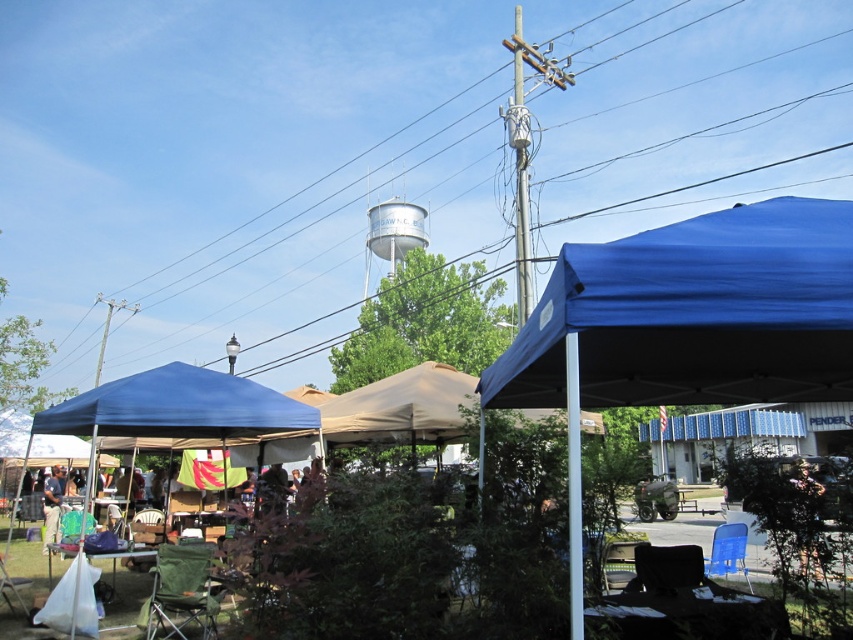
Question: Among these points, which one is nearest to the camera?

Choices:
 (A) (688, 548)
 (B) (521, 269)
 (C) (642, 538)

Answer: (A)

Question: Is blue fabric tent at upper center to the right of blue fabric canopy at upper right from the viewer's perspective?

Choices:
 (A) no
 (B) yes

Answer: (A)

Question: Is metallic gray pole at center wider than black fabric chair at lower right?

Choices:
 (A) no
 (B) yes

Answer: (B)

Question: Considering the relative positions of green canvas chair at lower left and metallic gray pole at center in the image provided, where is green canvas chair at lower left located with respect to metallic gray pole at center?

Choices:
 (A) right
 (B) left

Answer: (B)

Question: Which point is farther from the camera taking this photo?

Choices:
 (A) (761, 285)
 (B) (831, 365)
 (C) (12, 579)

Answer: (C)

Question: Which object appears farthest from the camera in this image?

Choices:
 (A) metallic gray pole at center
 (B) green fabric chair at lower left
 (C) blue fabric canopy at left

Answer: (A)